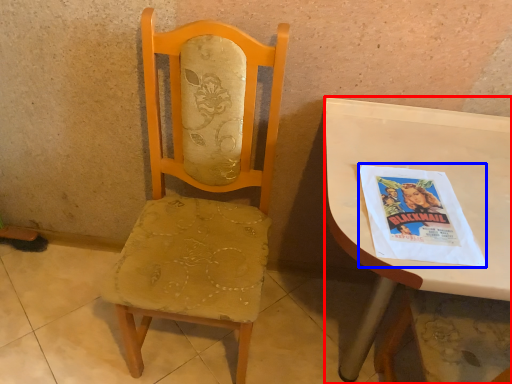
Question: Among these objects, which one is nearest to the camera, desk (highlighted by a red box) or comic book (highlighted by a blue box)?

Choices:
 (A) desk
 (B) comic book

Answer: (A)